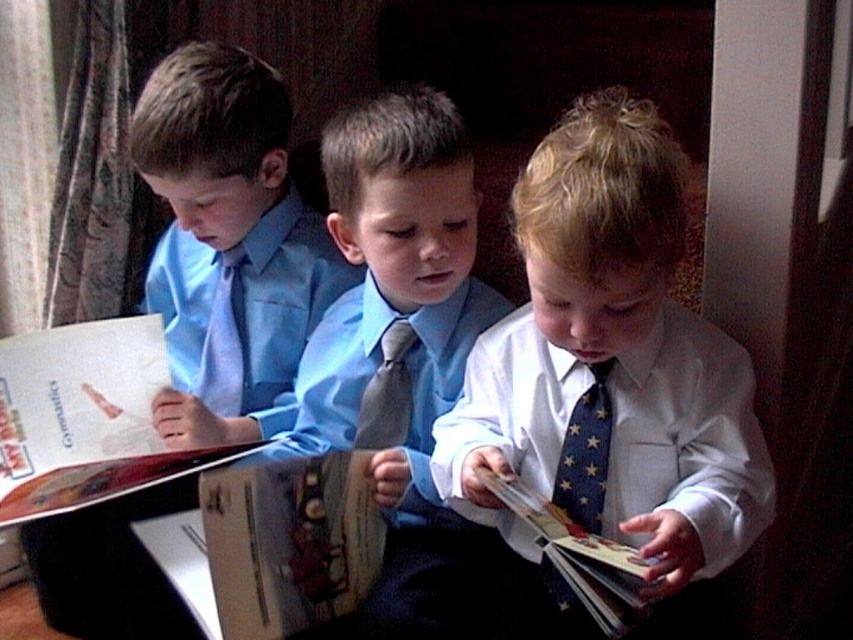
What is located at the coordinate point (85, 419) in the image?

A matte paper book at left is located at point (85, 419).